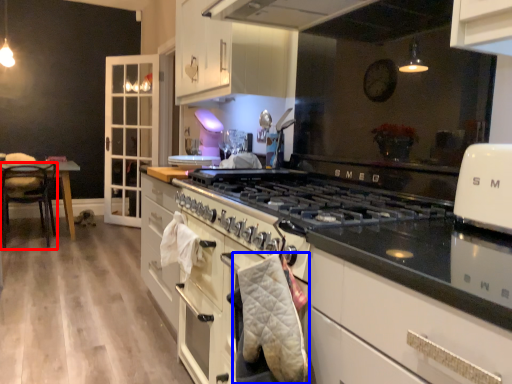
Question: Which of the following is the closest to the observer, chair (highlighted by a red box) or blanket (highlighted by a blue box)?

Choices:
 (A) chair
 (B) blanket

Answer: (B)